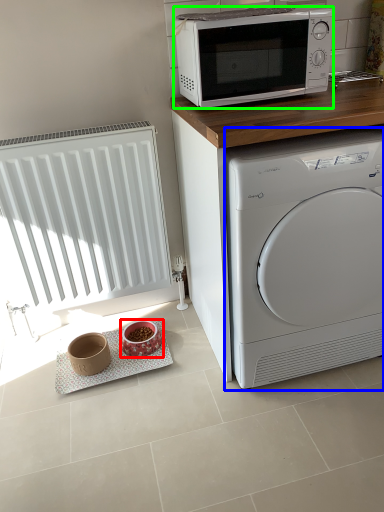
Question: Considering the real-world distances, which object is closest to appliance (highlighted by a red box)? washing machine (highlighted by a blue box) or microwave oven (highlighted by a green box).

Choices:
 (A) washing machine
 (B) microwave oven

Answer: (A)